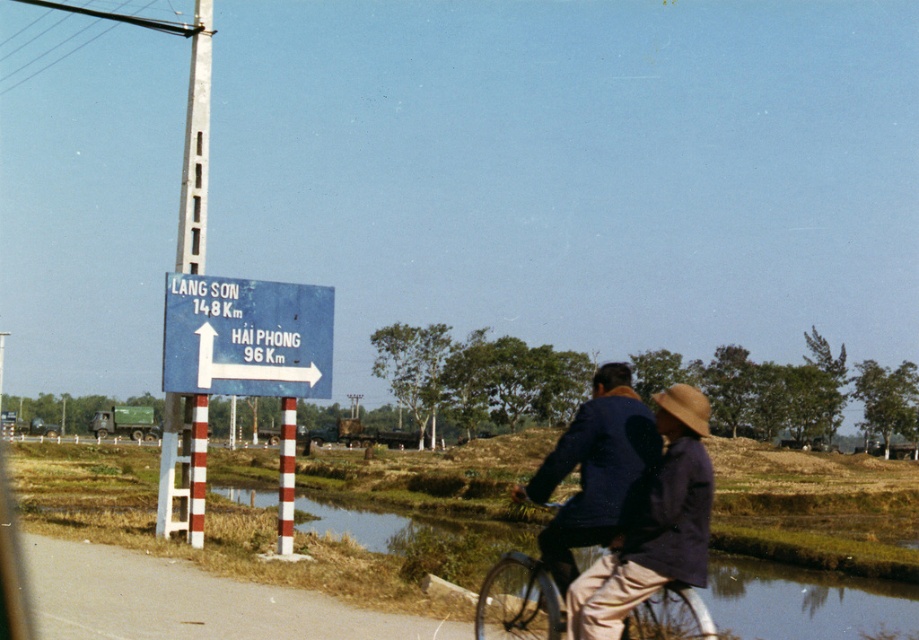
From the picture: You are a cyclist approaching the white painted metal pole at upper left while riding the bicycle with the dark blue fabric jacket at center. Can you safely stop before reaching the pole if you start braking 15 meters away?

The dark blue fabric jacket at center is 14.18 meters from the white painted metal pole at upper left. Since you started braking 15 meters away, you have enough distance to stop safely before reaching the pole.

You are a tourist on a bicycle ride and want to take a photo of the dark blue fabric jacket at center and the white painted metal pole at upper left. Which object should you focus on first to ensure both are in clear view?

You should focus on the dark blue fabric jacket at center first because it is closer to the viewer than the white painted metal pole at upper left, so adjusting focus from near to far will help both be in clear view.